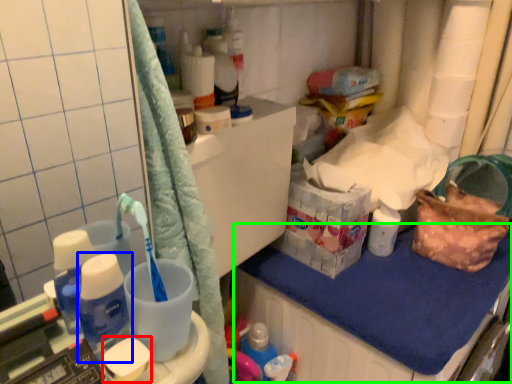
Question: Based on their relative distances, which object is nearer to soap (highlighted by a red box)? Choose from bottle (highlighted by a blue box) and counter top (highlighted by a green box).

Choices:
 (A) bottle
 (B) counter top

Answer: (A)